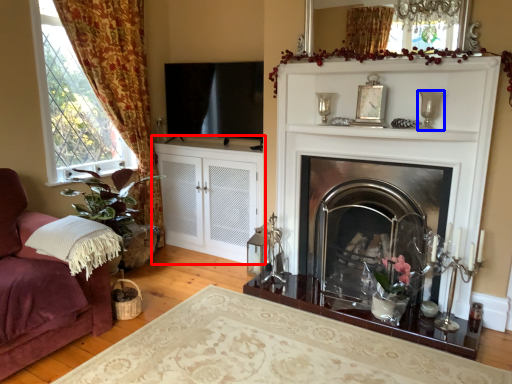
Question: Which object appears closest to the camera in this image, cabinetry (highlighted by a red box) or candle holder (highlighted by a blue box)?

Choices:
 (A) cabinetry
 (B) candle holder

Answer: (B)